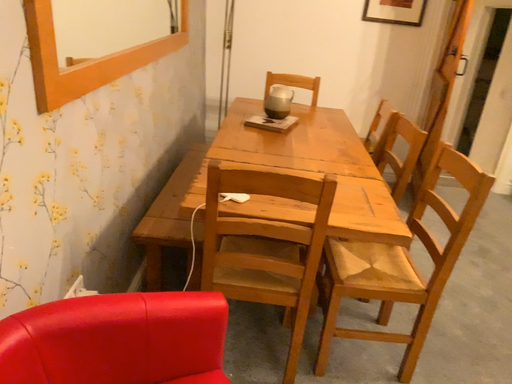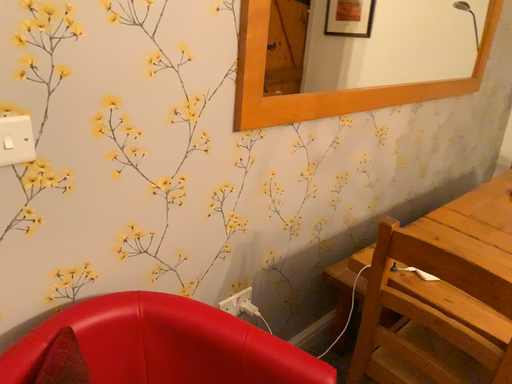
Question: Which way did the camera rotate in the video?

Choices:
 (A) rotated right
 (B) rotated left

Answer: (B)